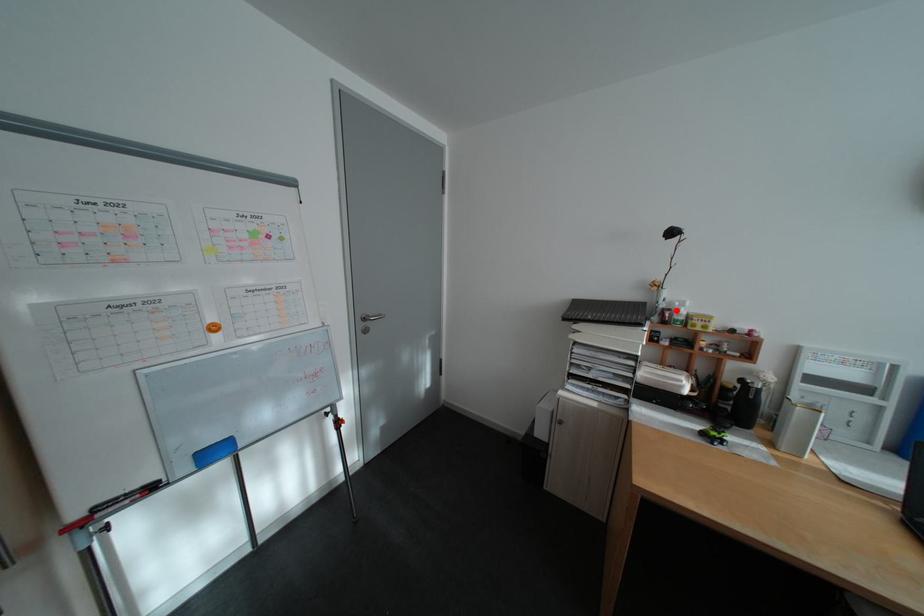
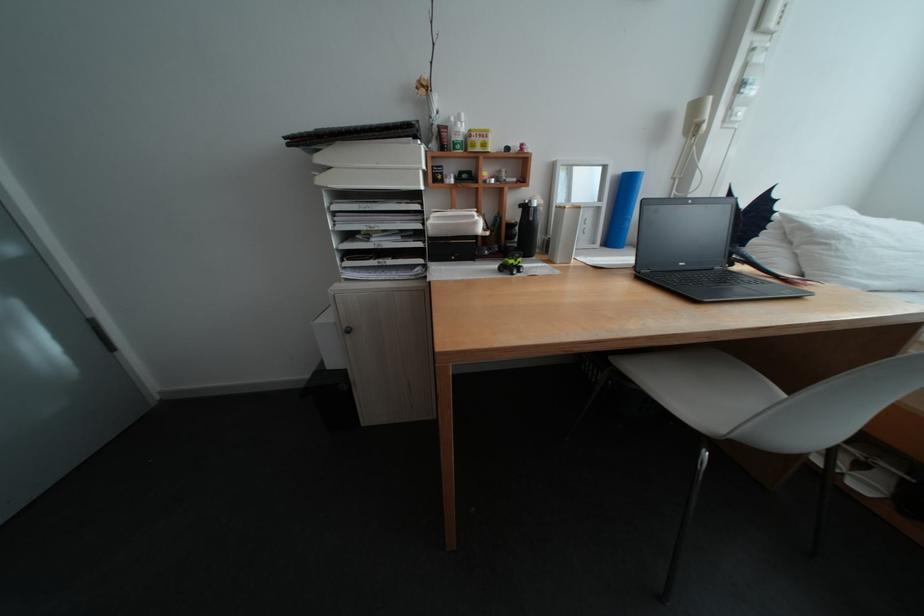
Where in the second image is the point corresponding to the highlighted location from the first image?

(453, 128)